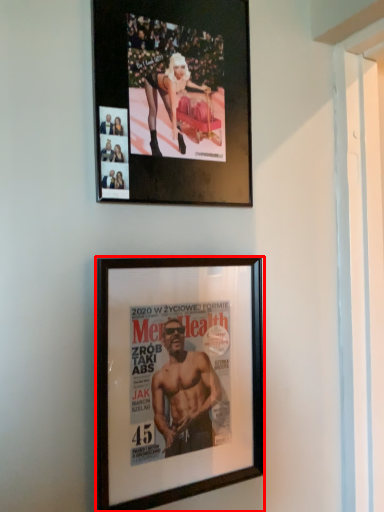
Question: Considering the relative positions of picture frame (annotated by the red box) and picture frame in the image provided, where is picture frame (annotated by the red box) located with respect to the staircase?

Choices:
 (A) right
 (B) left

Answer: (A)